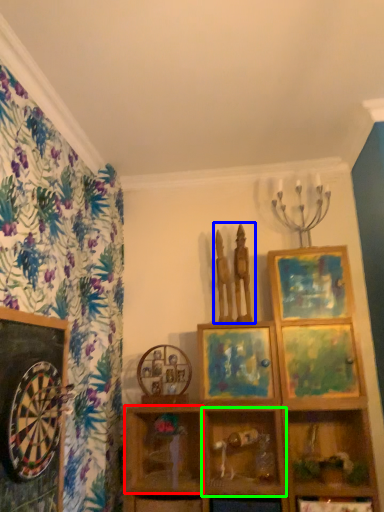
Question: Estimate the real-world distances between objects in this image. Which object is closer to cabinet (highlighted by a red box), sculpture (highlighted by a blue box) or shelf (highlighted by a green box)?

Choices:
 (A) sculpture
 (B) shelf

Answer: (B)